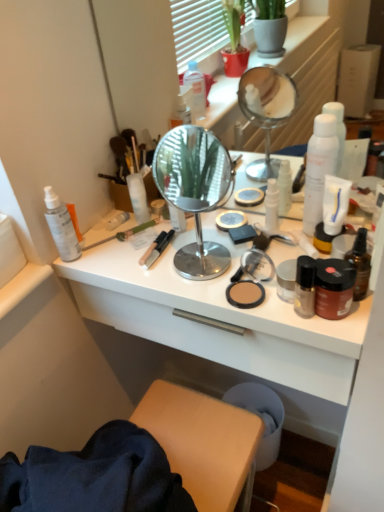
The height and width of the screenshot is (512, 384). I want to click on empty space that is in between translucent plastic spray bottle at left, the 1th toiletry when ordered from left to right, and white matte spray can at right, which is the 2th bottle from bottom to top, so click(x=178, y=247).